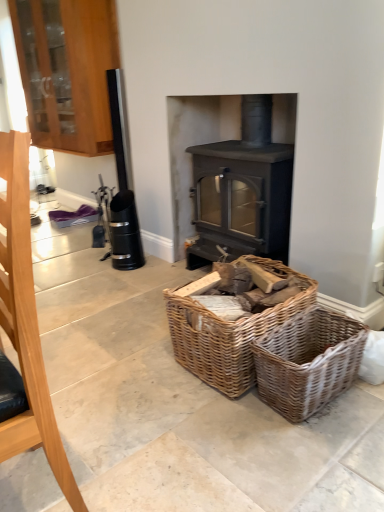
Locate an element on the screen. The width and height of the screenshot is (384, 512). vacant space to the right of brushed metal fireplace tool at left is located at coordinates (127, 470).